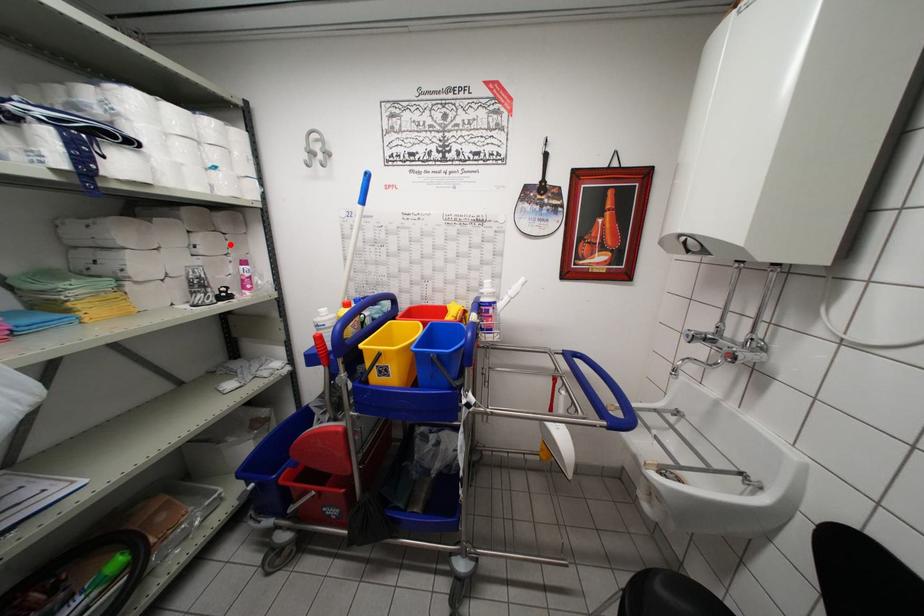
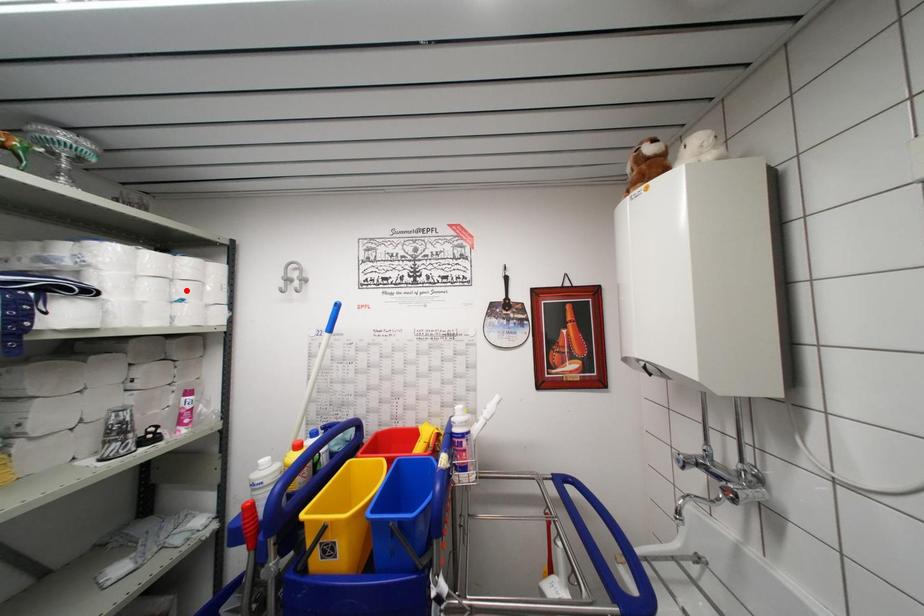
I am providing you with two images of the same scene from different viewpoints. A red point is marked on the first image and another point is marked on the second image. Does the point marked in image1 correspond to the same location as the one in image2?

No